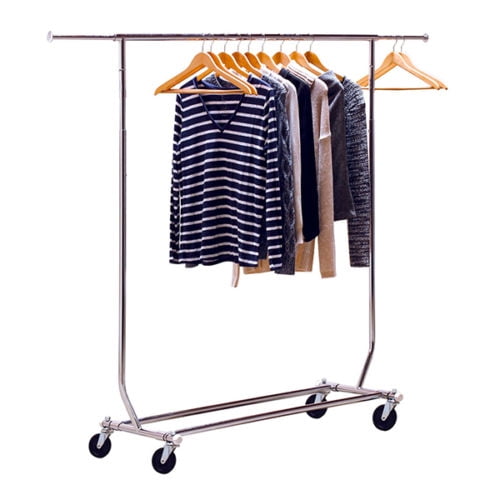
This screenshot has height=500, width=500. What are the coordinates of `rolling rack` in the screenshot? It's located at (362, 370).